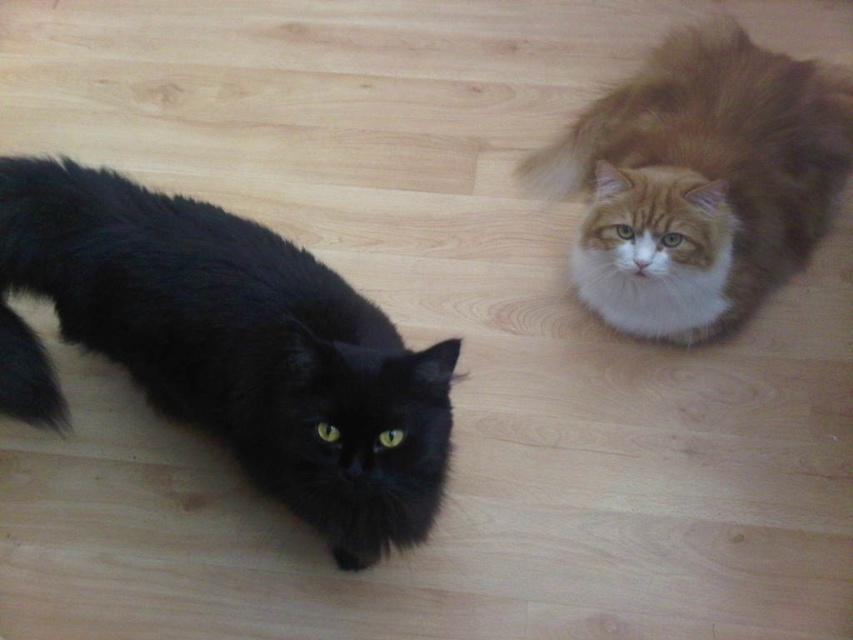
Question: Is the position of black fluffy cat at left more distant than that of fluffy brown cat at upper right?

Choices:
 (A) no
 (B) yes

Answer: (A)

Question: Can you confirm if black fluffy cat at left is positioned below fluffy brown cat at upper right?

Choices:
 (A) no
 (B) yes

Answer: (B)

Question: Is black fluffy cat at left to the right of fluffy brown cat at upper right from the viewer's perspective?

Choices:
 (A) yes
 (B) no

Answer: (B)